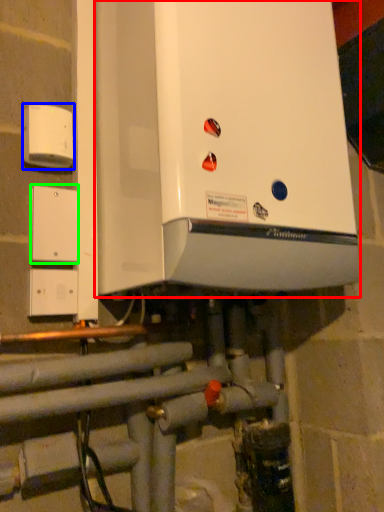
Question: Which object is the farthest from home appliance (highlighted by a red box)? Choose among these: electric outlet (highlighted by a blue box) or light switch (highlighted by a green box).

Choices:
 (A) electric outlet
 (B) light switch

Answer: (B)